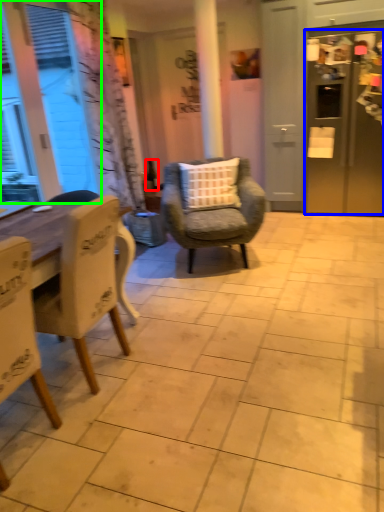
Question: Which is nearer to the bottle (highlighted by a red box)? refrigerator (highlighted by a blue box) or window screen (highlighted by a green box).

Choices:
 (A) refrigerator
 (B) window screen

Answer: (B)